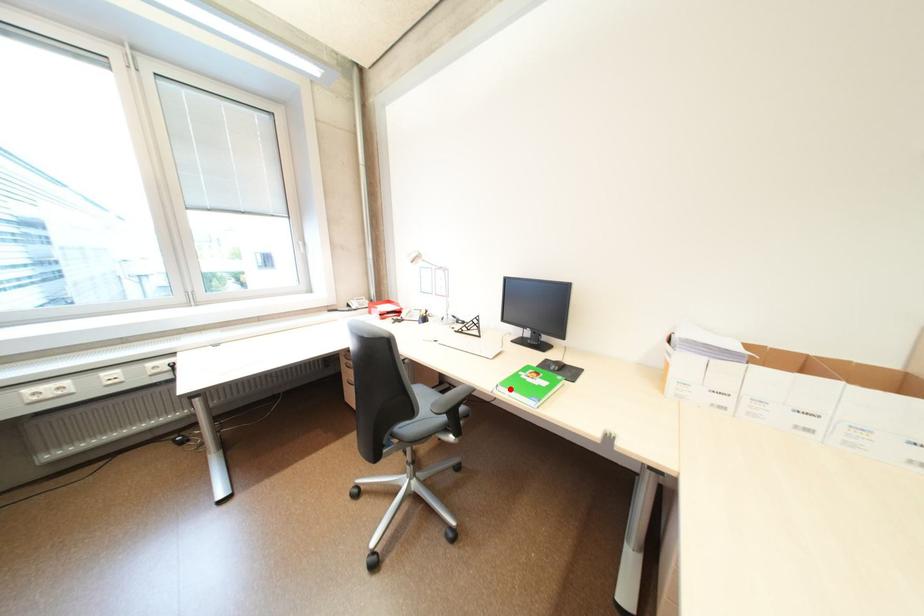
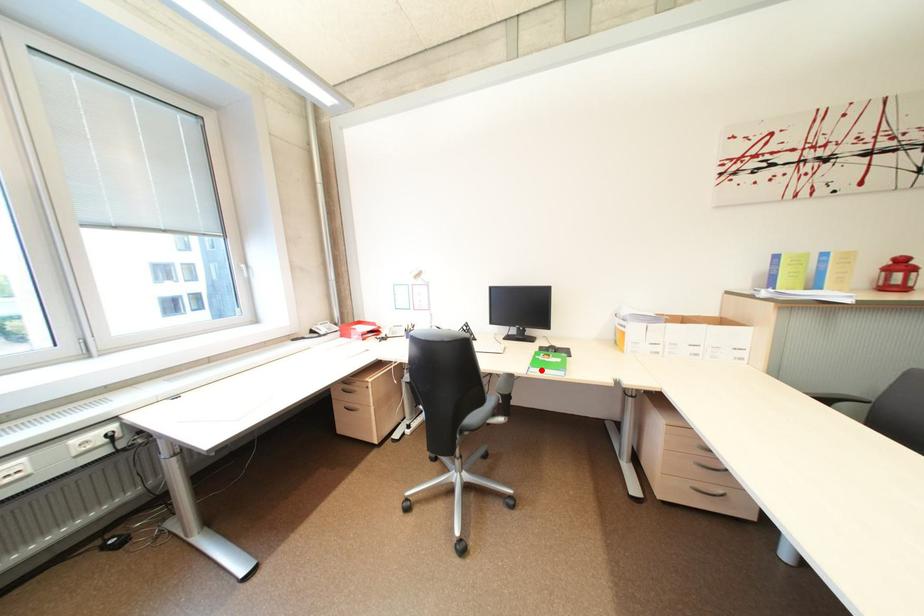
I am providing you with two images of the same scene from different viewpoints. A red point is marked on the first image and another point is marked on the second image. Is the marked point in image1 the same physical position as the marked point in image2?

Yes